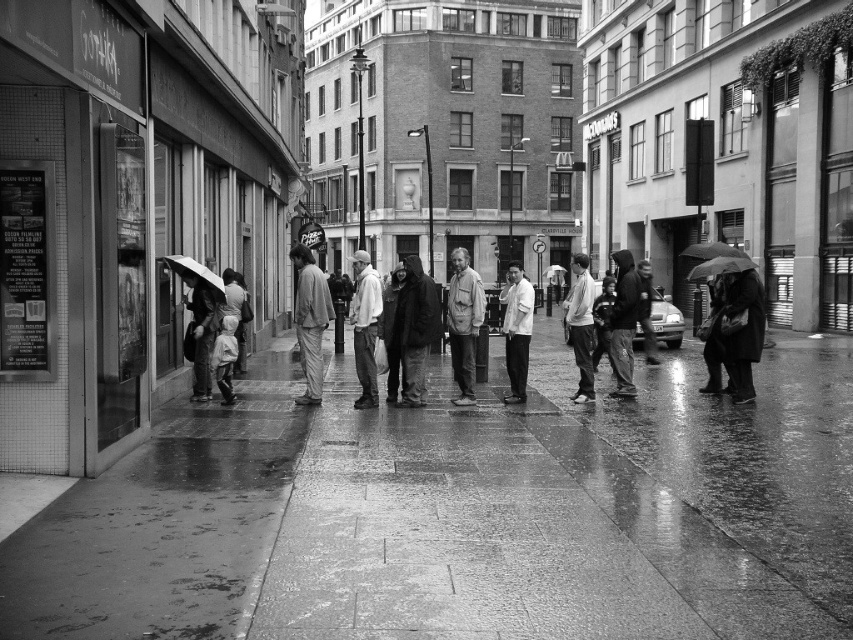
Looking at this image, does smooth concrete pavement at center have a greater width compared to light gray fabric pants at center?

Correct, the width of smooth concrete pavement at center exceeds that of light gray fabric pants at center.

Between smooth concrete pavement at center and light gray fabric pants at center, which one appears on the left side from the viewer's perspective?

From the viewer's perspective, light gray fabric pants at center appears more on the left side.

Who is more forward, (775, 404) or (323, 308)?

Point (323, 308) is more forward.

Where is `smooth concrete pavement at center`? Image resolution: width=853 pixels, height=640 pixels. smooth concrete pavement at center is located at coordinates (463, 513).

Is smooth concrete pavement at center closer to camera compared to matte gray jacket at center?

Yes.

Consider the image. Which of these two, smooth concrete pavement at center or matte gray jacket at center, stands taller?

With more height is matte gray jacket at center.

Is point (306, 544) farther from viewer compared to point (467, 336)?

No, it is in front of (467, 336).

The height and width of the screenshot is (640, 853). In order to click on smooth concrete pavement at center in this screenshot , I will do `click(463, 513)`.

Is white matte umbrella at left to the right of transparent plastic umbrella at lower right from the viewer's perspective?

In fact, white matte umbrella at left is to the left of transparent plastic umbrella at lower right.

Which is in front, point (195, 262) or point (717, 268)?

Point (195, 262) is more forward.

Does point (213, 282) come closer to viewer compared to point (706, 273)?

That is True.

Locate an element on the screen. white matte umbrella at left is located at coordinates (195, 273).